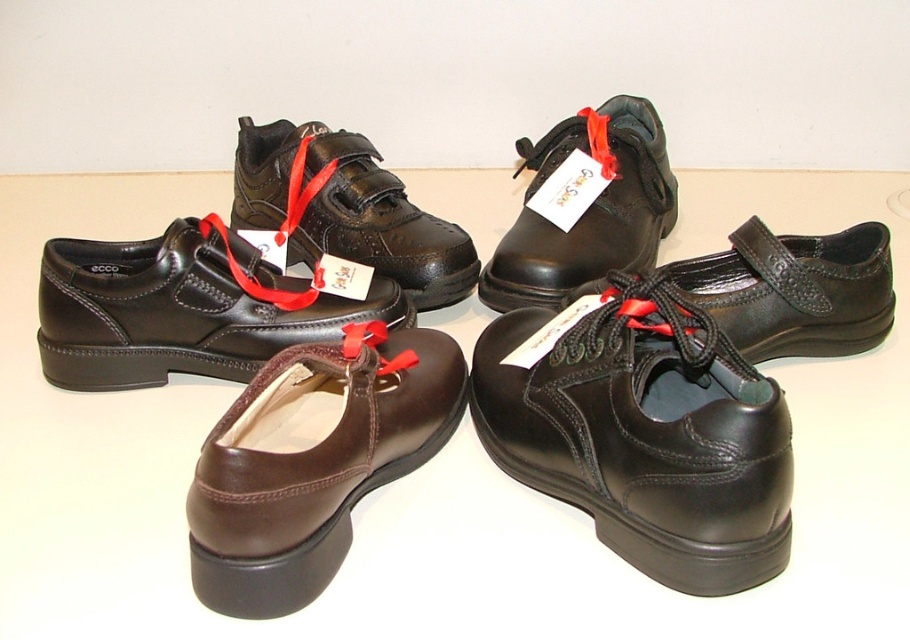
Question: Which of these objects is positioned closest to the brown leather shoe at lower left?

Choices:
 (A) black leather shoe at lower right
 (B) black leather shoe at upper left
 (C) black leather shoe at upper center

Answer: (A)

Question: Which of the following is the closest to the observer?

Choices:
 (A) black leather shoe at upper left
 (B) brown leather shoe at lower left
 (C) black leather shoe at lower right
 (D) black leather shoe at upper center

Answer: (B)

Question: Which object is closer to the camera taking this photo?

Choices:
 (A) black leather shoe at lower right
 (B) black leather shoe at center

Answer: (A)

Question: Does matte black shoe at lower left lie behind black leather shoe at upper left?

Choices:
 (A) no
 (B) yes

Answer: (A)

Question: Does black leather shoe at center come behind black leather shoe at upper center?

Choices:
 (A) no
 (B) yes

Answer: (A)

Question: Considering the relative positions of brown leather shoe at lower left and black leather shoe at upper left in the image provided, where is brown leather shoe at lower left located with respect to black leather shoe at upper left?

Choices:
 (A) right
 (B) left

Answer: (A)